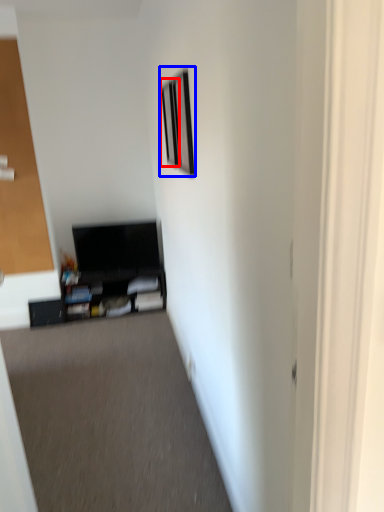
Question: Which object appears closest to the camera in this image, picture frame (highlighted by a red box) or picture frame (highlighted by a blue box)?

Choices:
 (A) picture frame
 (B) picture frame

Answer: (B)